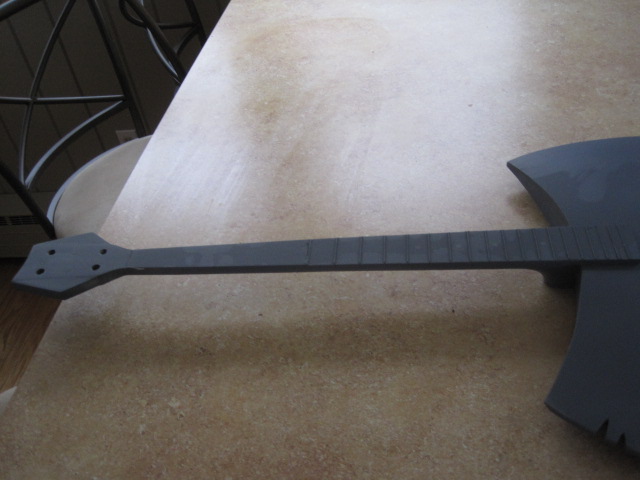
Image resolution: width=640 pixels, height=480 pixels. What are the coordinates of `chair` in the screenshot? It's located at (102, 179), (177, 57).